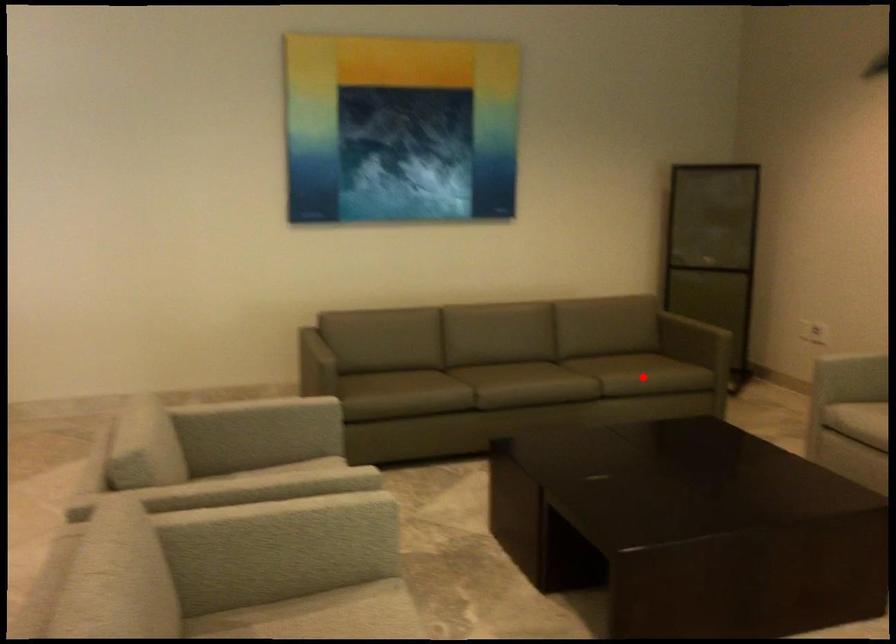
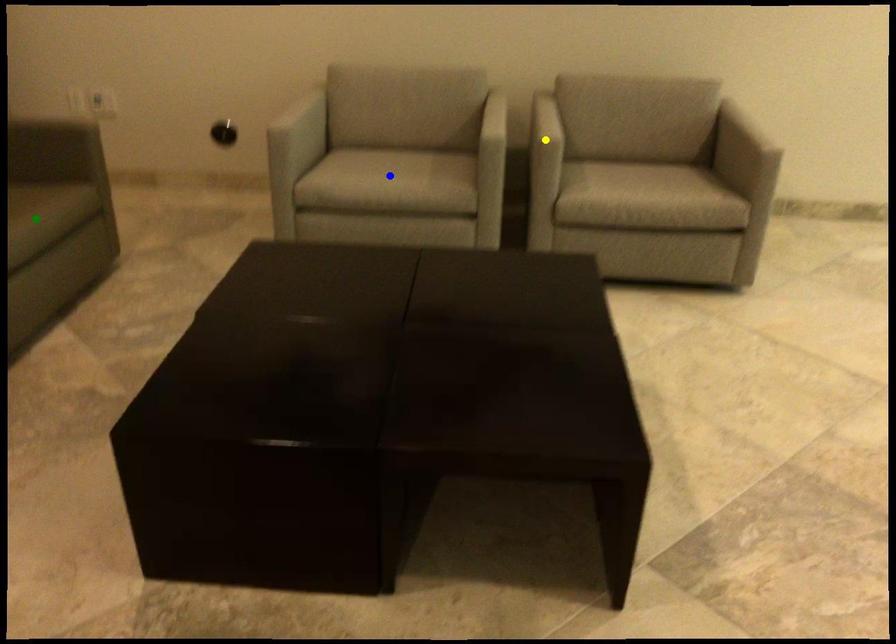
Question: I am providing you with two images of the same scene from different viewpoints. A red point is marked on the first image. You are given multiple points on the second image. Which point in image 2 represents the same 3d spot as the red point in image 1?

Choices:
 (A) blue point
 (B) green point
 (C) yellow point

Answer: (B)